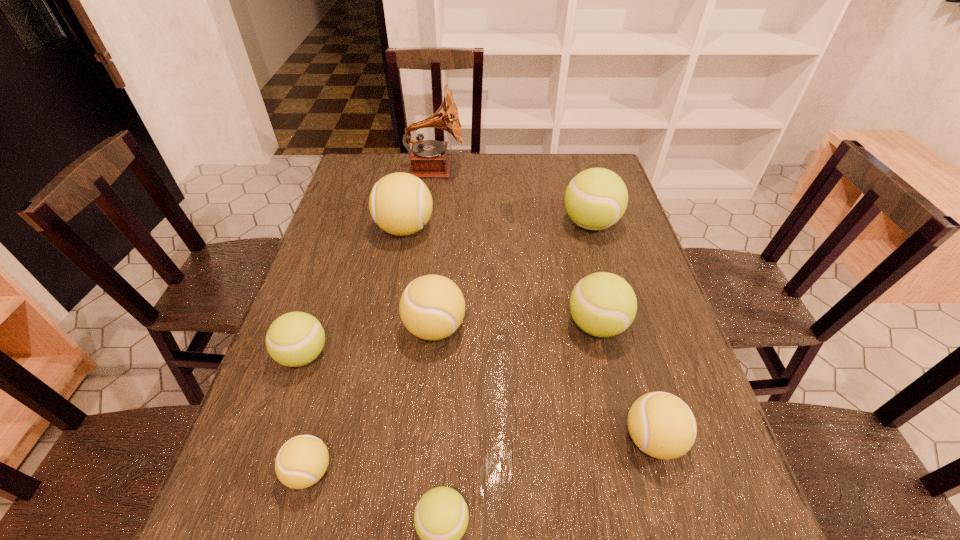
Locate an element on the screen. the fourth closest object relative to the third smallest green tennis ball is located at coordinates (441, 517).

This screenshot has height=540, width=960. In order to click on tennis ball that is the fifth closest to the second biggest green tennis ball in this screenshot , I will do `click(400, 203)`.

The width and height of the screenshot is (960, 540). In order to click on tennis ball that is the fifth closest to the farthest green tennis ball in this screenshot , I will do `click(294, 339)`.

Locate an element on the screen. This screenshot has height=540, width=960. green tennis ball identified as the second closest to the farthest object is located at coordinates (602, 304).

Select which green tennis ball is the second closest to the biggest green tennis ball. Please provide its 2D coordinates. Your answer should be formatted as a tuple, i.e. [(x, y)], where the tuple contains the x and y coordinates of a point satisfying the conditions above.

[(294, 339)]

Identify the location of yellow tennis ball that can be found as the closest to the third biggest yellow tennis ball. (432, 307).

Where is `the second closest yellow tennis ball relative to the phonograph_record`? The height and width of the screenshot is (540, 960). the second closest yellow tennis ball relative to the phonograph_record is located at coordinates (432, 307).

Where is `blank space that satisfies the following two spatial constraints: 1. on the horn of the farthest object; 2. on the right side of the third smallest green tennis ball`? Image resolution: width=960 pixels, height=540 pixels. blank space that satisfies the following two spatial constraints: 1. on the horn of the farthest object; 2. on the right side of the third smallest green tennis ball is located at coordinates (414, 325).